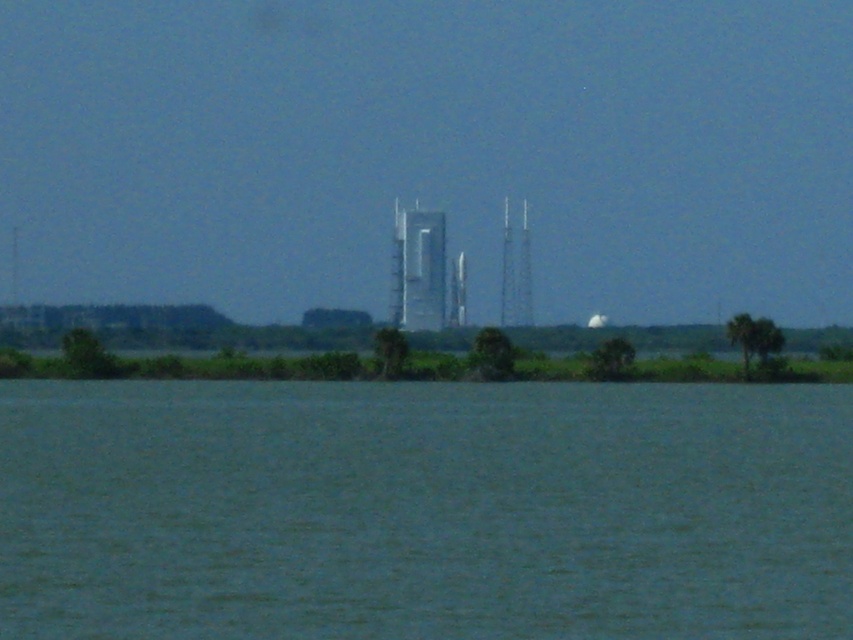
From the picture: What are the coordinates of the smooth silver tower at center?

The smooth silver tower at center is located at coordinates point (x=515, y=273).

You are standing at the center of the image and want to locate the metallic silver tower at center. Based on the coordinates provided, in which direction should you look to find it?

The metallic silver tower at center is located at coordinates point (418, 269), which is slightly to the left and directly in the center vertically. Since you are at the center, you should look slightly to the left to find it.

From the picture: You are an astronaut preparing for a space mission and see the smooth silver tower at center and the shiny metallic rocket at center in the image. Which object is positioned higher in the scene?

The smooth silver tower at center is located above the shiny metallic rocket at center, so it is positioned higher in the scene.